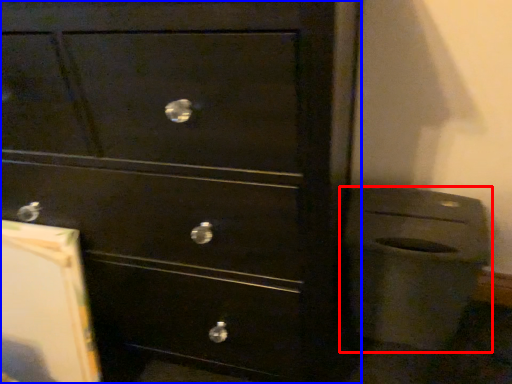
Question: Which object is further to the camera taking this photo, waste container (highlighted by a red box) or chest of drawers (highlighted by a blue box)?

Choices:
 (A) waste container
 (B) chest of drawers

Answer: (A)